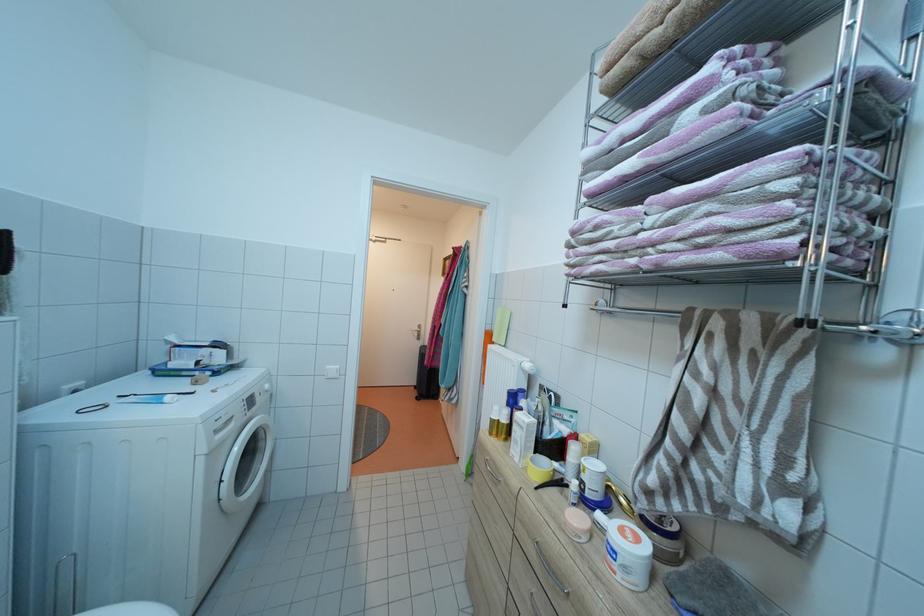
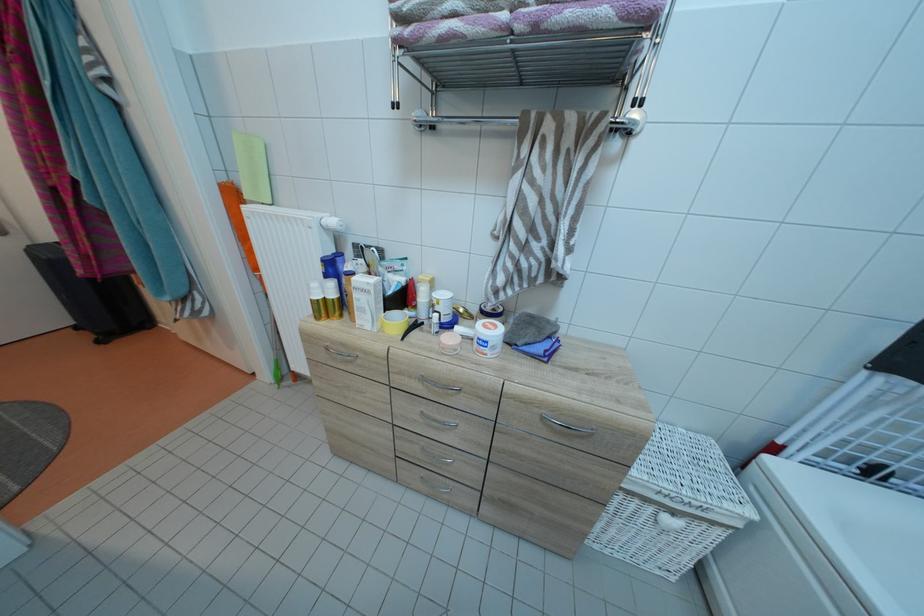
In the second image, find the point that corresponds to point (512, 426) in the first image.

(341, 301)